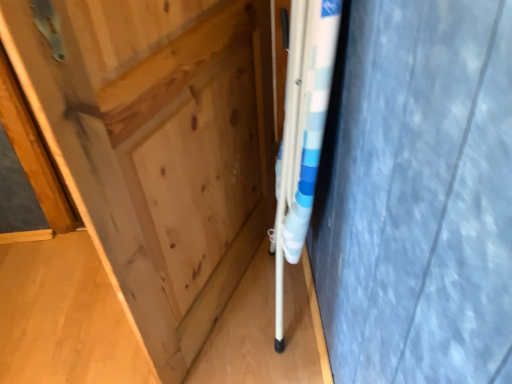
Where is `free space on the front side of white plastic crutch at center`? This screenshot has width=512, height=384. free space on the front side of white plastic crutch at center is located at coordinates (276, 359).